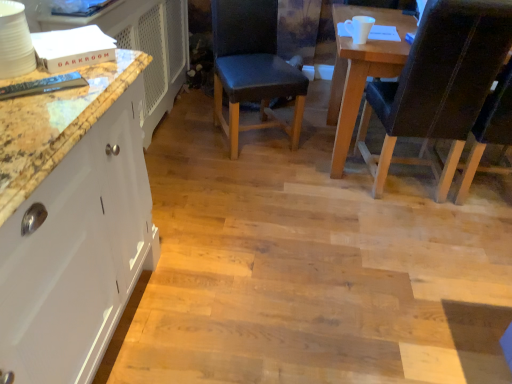
Image resolution: width=512 pixels, height=384 pixels. What do you see at coordinates (439, 85) in the screenshot? I see `leather-like black chair at right, marked as the 2th chair in a left-to-right arrangement` at bounding box center [439, 85].

The height and width of the screenshot is (384, 512). Identify the location of leather-like black chair at right, positioned as the 1th chair in right-to-left order. (439, 85).

You are a GUI agent. You are given a task and a screenshot of the screen. Output one action in this format:
    pyautogui.click(x=<x>, y=<y>)
    Task: Click on the dark blue leather chair at center, acting as the first chair starting from the left
    This screenshot has height=384, width=512.
    Given the screenshot: What is the action you would take?
    pyautogui.click(x=252, y=68)

What do you see at coordinates (252, 68) in the screenshot? I see `dark blue leather chair at center, acting as the first chair starting from the left` at bounding box center [252, 68].

At what (x,y) coordinates should I click in order to perform the action: click on leather-like black chair at right, marked as the 2th chair in a left-to-right arrangement. Please return your answer as a coordinate pair (x, y). This screenshot has width=512, height=384. Looking at the image, I should click on (439, 85).

Is leather-like black chair at right, positioned as the 1th chair in right-to-left order, at the right side of dark blue leather chair at center, the second chair when ordered from right to left?

Indeed, leather-like black chair at right, positioned as the 1th chair in right-to-left order, is positioned on the right side of dark blue leather chair at center, the second chair when ordered from right to left.

Is leather-like black chair at right, marked as the 2th chair in a left-to-right arrangement, positioned in front of dark blue leather chair at center, acting as the first chair starting from the left?

Yes, the depth of leather-like black chair at right, marked as the 2th chair in a left-to-right arrangement, is less than that of dark blue leather chair at center, acting as the first chair starting from the left.

Does point (421, 68) come closer to viewer compared to point (280, 77)?

Yes, it is in front of point (280, 77).

From the image's perspective, which object appears higher, leather-like black chair at right, positioned as the 1th chair in right-to-left order, or dark blue leather chair at center, the second chair when ordered from right to left?

dark blue leather chair at center, the second chair when ordered from right to left, is shown above in the image.

From a real-world perspective, is leather-like black chair at right, marked as the 2th chair in a left-to-right arrangement, over dark blue leather chair at center, acting as the first chair starting from the left?

Yes, from a real-world perspective, leather-like black chair at right, marked as the 2th chair in a left-to-right arrangement, is over dark blue leather chair at center, acting as the first chair starting from the left

Consider the image. Looking at their sizes, would you say leather-like black chair at right, marked as the 2th chair in a left-to-right arrangement, is wider or thinner than dark blue leather chair at center, acting as the first chair starting from the left?

leather-like black chair at right, marked as the 2th chair in a left-to-right arrangement, is wider than dark blue leather chair at center, acting as the first chair starting from the left.

Based on the photo, is leather-like black chair at right, positioned as the 1th chair in right-to-left order, shorter than dark blue leather chair at center, acting as the first chair starting from the left?

In fact, leather-like black chair at right, positioned as the 1th chair in right-to-left order, may be taller than dark blue leather chair at center, acting as the first chair starting from the left.

Looking at this image, considering the relative sizes of leather-like black chair at right, positioned as the 1th chair in right-to-left order, and dark blue leather chair at center, the second chair when ordered from right to left, in the image provided, is leather-like black chair at right, positioned as the 1th chair in right-to-left order, smaller than dark blue leather chair at center, the second chair when ordered from right to left,?

Incorrect, leather-like black chair at right, positioned as the 1th chair in right-to-left order, is not smaller in size than dark blue leather chair at center, the second chair when ordered from right to left.

Is leather-like black chair at right, positioned as the 1th chair in right-to-left order, spatially inside dark blue leather chair at center, acting as the first chair starting from the left, or outside of it?

leather-like black chair at right, positioned as the 1th chair in right-to-left order, is not enclosed by dark blue leather chair at center, acting as the first chair starting from the left.

Is leather-like black chair at right, marked as the 2th chair in a left-to-right arrangement, directly adjacent to dark blue leather chair at center, acting as the first chair starting from the left?

No, leather-like black chair at right, marked as the 2th chair in a left-to-right arrangement, is not beside dark blue leather chair at center, acting as the first chair starting from the left.

Could you tell me if leather-like black chair at right, marked as the 2th chair in a left-to-right arrangement, is facing dark blue leather chair at center, acting as the first chair starting from the left?

No, leather-like black chair at right, marked as the 2th chair in a left-to-right arrangement, is not oriented towards dark blue leather chair at center, acting as the first chair starting from the left.

How different are the orientations of leather-like black chair at right, marked as the 2th chair in a left-to-right arrangement, and dark blue leather chair at center, the second chair when ordered from right to left, in degrees?

160 degrees separate the facing orientations of leather-like black chair at right, marked as the 2th chair in a left-to-right arrangement, and dark blue leather chair at center, the second chair when ordered from right to left.

Measure the distance from leather-like black chair at right, marked as the 2th chair in a left-to-right arrangement, to dark blue leather chair at center, the second chair when ordered from right to left.

They are 28.86 inches apart.

Where is `chair above the leather-like black chair at right, positioned as the 1th chair in right-to-left order (from the image's perspective)`? chair above the leather-like black chair at right, positioned as the 1th chair in right-to-left order (from the image's perspective) is located at coordinates (252, 68).

Between dark blue leather chair at center, acting as the first chair starting from the left, and leather-like black chair at right, positioned as the 1th chair in right-to-left order, which one appears on the left side from the viewer's perspective?

From the viewer's perspective, dark blue leather chair at center, acting as the first chair starting from the left, appears more on the left side.

Considering the positions of objects dark blue leather chair at center, acting as the first chair starting from the left, and leather-like black chair at right, marked as the 2th chair in a left-to-right arrangement, in the image provided, who is behind, dark blue leather chair at center, acting as the first chair starting from the left, or leather-like black chair at right, marked as the 2th chair in a left-to-right arrangement,?

dark blue leather chair at center, acting as the first chair starting from the left.

Does point (258, 70) lie behind point (494, 38)?

Yes, point (258, 70) is farther from viewer.

From the image's perspective, which is above, dark blue leather chair at center, acting as the first chair starting from the left, or leather-like black chair at right, marked as the 2th chair in a left-to-right arrangement?

dark blue leather chair at center, acting as the first chair starting from the left, appears higher in the image.

From a real-world perspective, is dark blue leather chair at center, the second chair when ordered from right to left, located beneath leather-like black chair at right, marked as the 2th chair in a left-to-right arrangement?

Yes, from a real-world perspective, dark blue leather chair at center, the second chair when ordered from right to left, is under leather-like black chair at right, marked as the 2th chair in a left-to-right arrangement.

Considering the sizes of dark blue leather chair at center, the second chair when ordered from right to left, and leather-like black chair at right, positioned as the 1th chair in right-to-left order, in the image, is dark blue leather chair at center, the second chair when ordered from right to left, wider or thinner than leather-like black chair at right, positioned as the 1th chair in right-to-left order,?

dark blue leather chair at center, the second chair when ordered from right to left, is thinner than leather-like black chair at right, positioned as the 1th chair in right-to-left order.

Is dark blue leather chair at center, the second chair when ordered from right to left, shorter than leather-like black chair at right, positioned as the 1th chair in right-to-left order?

Correct, dark blue leather chair at center, the second chair when ordered from right to left, is not as tall as leather-like black chair at right, positioned as the 1th chair in right-to-left order.

In terms of size, does dark blue leather chair at center, acting as the first chair starting from the left, appear bigger or smaller than leather-like black chair at right, marked as the 2th chair in a left-to-right arrangement?

Considering their sizes, dark blue leather chair at center, acting as the first chair starting from the left, takes up less space than leather-like black chair at right, marked as the 2th chair in a left-to-right arrangement.

Choose the correct answer: Is dark blue leather chair at center, the second chair when ordered from right to left, inside leather-like black chair at right, positioned as the 1th chair in right-to-left order, or outside it?

dark blue leather chair at center, the second chair when ordered from right to left, cannot be found inside leather-like black chair at right, positioned as the 1th chair in right-to-left order.

Is dark blue leather chair at center, the second chair when ordered from right to left, not close to leather-like black chair at right, marked as the 2th chair in a left-to-right arrangement?

That's not correct — dark blue leather chair at center, the second chair when ordered from right to left, is a little close to leather-like black chair at right, marked as the 2th chair in a left-to-right arrangement.

Is dark blue leather chair at center, the second chair when ordered from right to left, positioned with its back to leather-like black chair at right, marked as the 2th chair in a left-to-right arrangement?

No, dark blue leather chair at center, the second chair when ordered from right to left, is not facing the opposite direction of leather-like black chair at right, marked as the 2th chair in a left-to-right arrangement.

Can you tell me how much dark blue leather chair at center, acting as the first chair starting from the left, and leather-like black chair at right, marked as the 2th chair in a left-to-right arrangement, differ in facing direction?

dark blue leather chair at center, acting as the first chair starting from the left, and leather-like black chair at right, marked as the 2th chair in a left-to-right arrangement, are facing 160 degrees away from each other.

How distant is dark blue leather chair at center, acting as the first chair starting from the left, from leather-like black chair at right, positioned as the 1th chair in right-to-left order?

28.86 inches.

Where is `chair lying in front of the dark blue leather chair at center, the second chair when ordered from right to left`? Image resolution: width=512 pixels, height=384 pixels. chair lying in front of the dark blue leather chair at center, the second chair when ordered from right to left is located at coordinates (439, 85).

Identify the location of chair that appears in front of the dark blue leather chair at center, acting as the first chair starting from the left. (439, 85).

Identify the location of chair that is under the leather-like black chair at right, marked as the 2th chair in a left-to-right arrangement (from a real-world perspective). This screenshot has width=512, height=384. (252, 68).